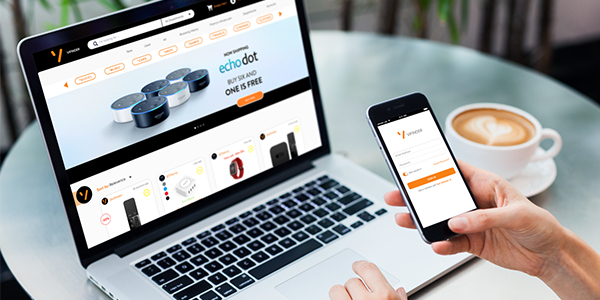
The width and height of the screenshot is (600, 300). I want to click on keyboard, so click(x=247, y=238).